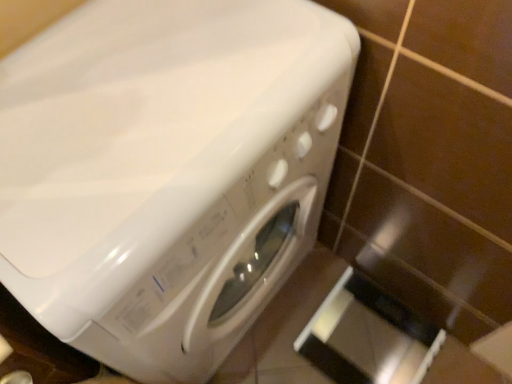
You are a GUI agent. You are given a task and a screenshot of the screen. Output one action in this format:
    pyautogui.click(x=<x>, y=<y>)
    Task: Click on the vacant area on top of white glossy washing machine at upper left (from a real-world perspective)
    Image resolution: width=512 pixels, height=384 pixels.
    Given the screenshot: What is the action you would take?
    pyautogui.click(x=129, y=100)